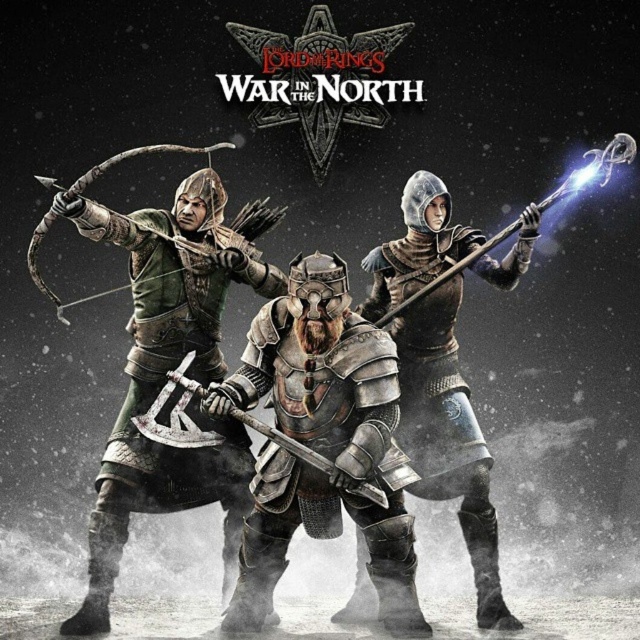
Question: Based on their relative distances, which object is nearer to the shiny silver armor at center?

Choices:
 (A) shiny silver staff at center
 (B) green leather armor at left

Answer: (A)

Question: Based on their relative distances, which object is nearer to the polished silver armor at center?

Choices:
 (A) shiny silver staff at center
 (B) shiny silver armor at center
 (C) green leather armor at left

Answer: (C)

Question: Can you confirm if green leather armor at left is smaller than polished silver armor at center?

Choices:
 (A) yes
 (B) no

Answer: (B)

Question: Among these points, which one is nearest to the camera?

Choices:
 (A) (381, 385)
 (B) (518, 221)

Answer: (A)

Question: Is green leather armor at left thinner than polished silver armor at center?

Choices:
 (A) yes
 (B) no

Answer: (B)

Question: Does shiny silver armor at center have a greater width compared to shiny silver staff at center?

Choices:
 (A) no
 (B) yes

Answer: (A)